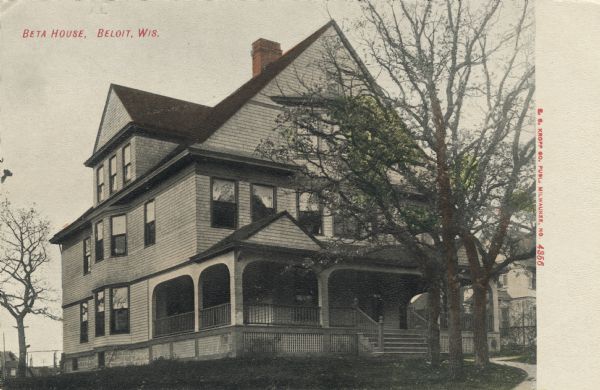
The width and height of the screenshot is (600, 390). I want to click on window, so click(95, 314).